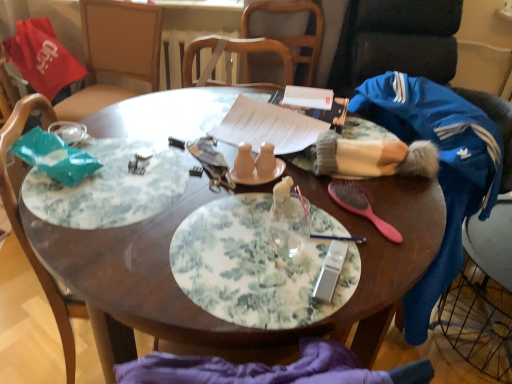
This screenshot has height=384, width=512. Identify the location of vacant space that is in between floral-patterned plate at center and pink plastic hairbrush at center-right, which is the fifth tableware from left to right. (369, 248).